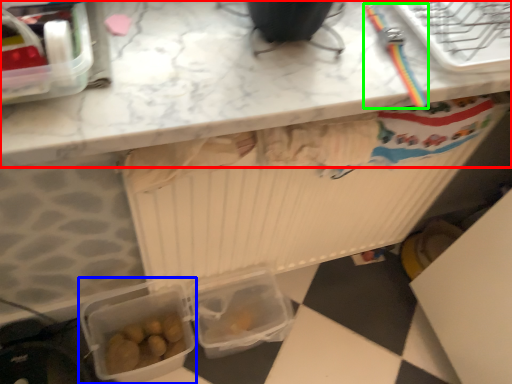
Question: Which object is positioned closest to countertop (highlighted by a red box)? Select from lunch box (highlighted by a blue box) and tool (highlighted by a green box).

Choices:
 (A) lunch box
 (B) tool

Answer: (B)